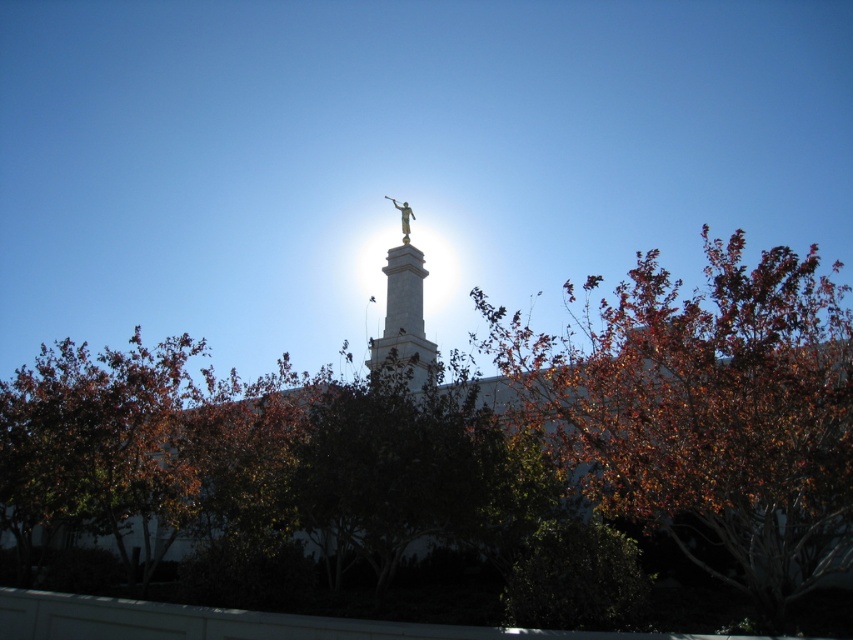
You are a drone operator trying to capture a photo of the gold metallic statue at upper center. However, the autumn leaves at upper center are blocking your view. What is the minimum distance you need to move your drone forward to ensure the statue is fully visible?

The minimum distance you need to move your drone forward is 67.08 meters to ensure the gold metallic statue at upper center is fully visible, as that is the distance between the autumn leaves at upper center and the statue.

You are standing 60 meters away from the gold polished statue at center. Can you clearly see the statue? Please explain your reasoning based on the distance provided.

The gold polished statue at center is 59.81 meters away from the viewer. Since you are standing 60 meters away, you are just slightly farther than the actual distance. However, the sun is positioned behind the statue, creating a lens flare effect that partially obscures the view. Therefore, even at this close proximity, the statue might not be clearly visible due to the glare.

You are standing in the park and see the autumn leaves at upper center and the gold polished statue at center. Which object is positioned to the right of the other?

The autumn leaves at upper center are to the right of the gold polished statue at center.